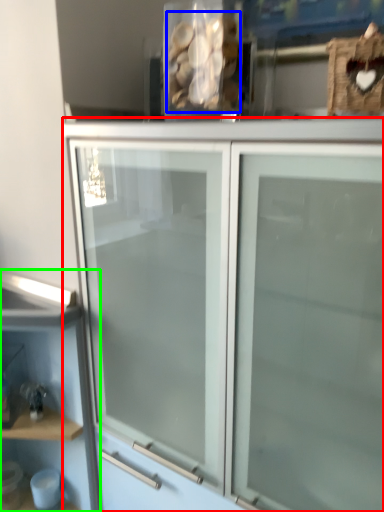
Question: Considering the real-world distances, which object is closest to cupboard (highlighted by a red box)? stuff (highlighted by a blue box) or shelf (highlighted by a green box).

Choices:
 (A) stuff
 (B) shelf

Answer: (B)